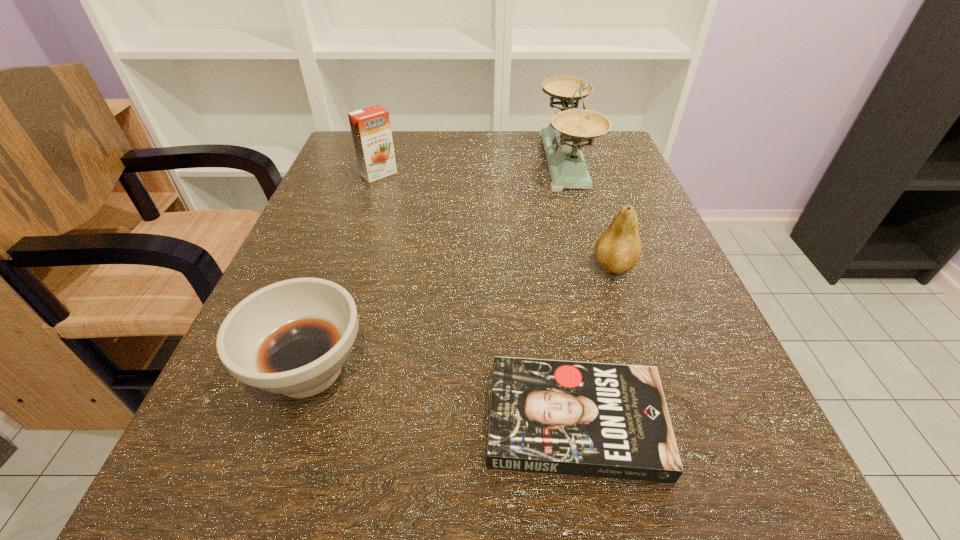
At what (x,y) coordinates should I click in order to perform the action: click on the tallest object. Please return your answer as a coordinate pair (x, y). This screenshot has height=540, width=960. Looking at the image, I should click on (x=562, y=139).

Find the location of a particular element. This screenshot has width=960, height=540. orange juice is located at coordinates (371, 130).

Identify the location of the third farthest object. This screenshot has height=540, width=960. (618, 248).

In order to click on the fourth tallest object in this screenshot , I will do `click(292, 337)`.

I want to click on book, so click(605, 420).

You are a GUI agent. You are given a task and a screenshot of the screen. Output one action in this format:
    pyautogui.click(x=<x>, y=<y>)
    Task: Click on the free space located 0.120m on the front-facing side of the scale
    The height and width of the screenshot is (540, 960).
    Given the screenshot: What is the action you would take?
    pyautogui.click(x=485, y=161)

I want to click on blank space located 0.090m on the front-facing side of the scale, so pos(498,161).

Identify the location of vacant space situated on the front-facing side of the scale. (398, 161).

Locate an element on the screen. Image resolution: width=960 pixels, height=540 pixels. vacant space situated 0.340m on the front of the orange juice is located at coordinates (336, 304).

Where is `vacant area situated on the front of the pear`? vacant area situated on the front of the pear is located at coordinates (628, 309).